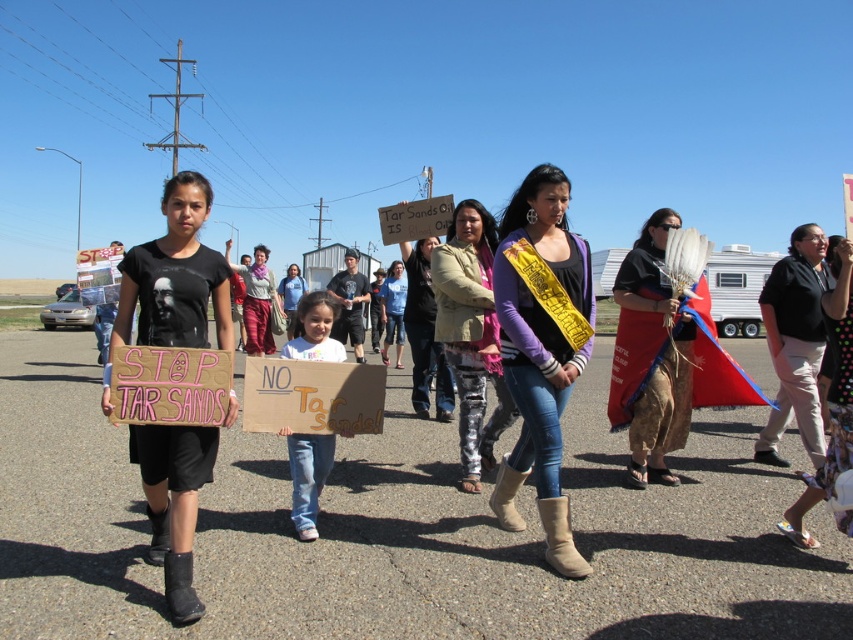
Question: Estimate the real-world distances between objects in this image. Which object is farther from the camouflage pants at center?

Choices:
 (A) matte purple sweater at center
 (B) denim jeans at center

Answer: (B)

Question: Can you confirm if blue fabric headdress at right is bigger than denim jeans at center?

Choices:
 (A) yes
 (B) no

Answer: (B)

Question: Does camouflage pants at center have a lesser width compared to blue fabric headdress at right?

Choices:
 (A) no
 (B) yes

Answer: (A)

Question: Among these points, which one is farthest from the camera?

Choices:
 (A) (509, 412)
 (B) (618, 326)

Answer: (B)

Question: Is matte purple sweater at center bigger than camouflage pants at center?

Choices:
 (A) yes
 (B) no

Answer: (B)

Question: Which object is the closest to the denim jeans at center?

Choices:
 (A) matte purple sweater at center
 (B) blue fabric headdress at right

Answer: (A)